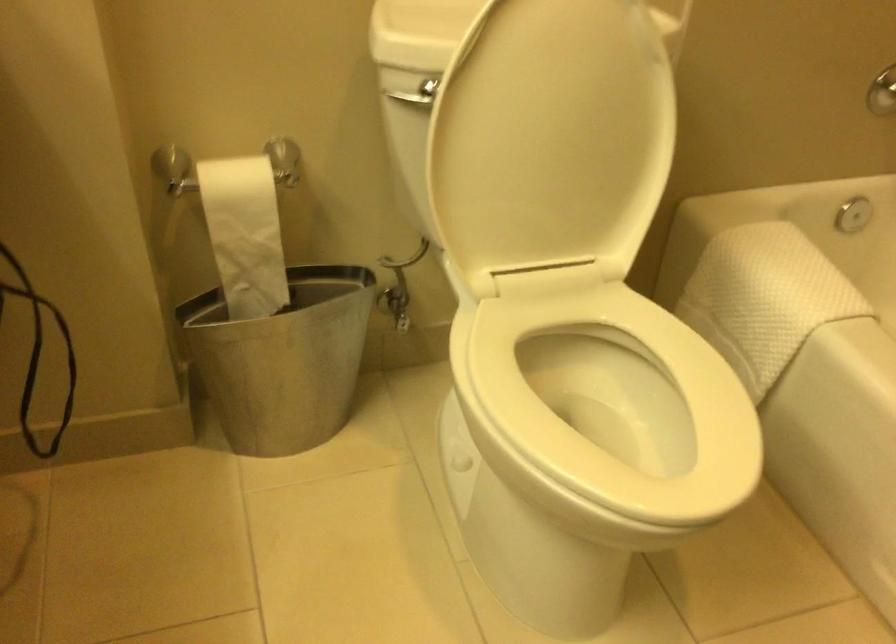
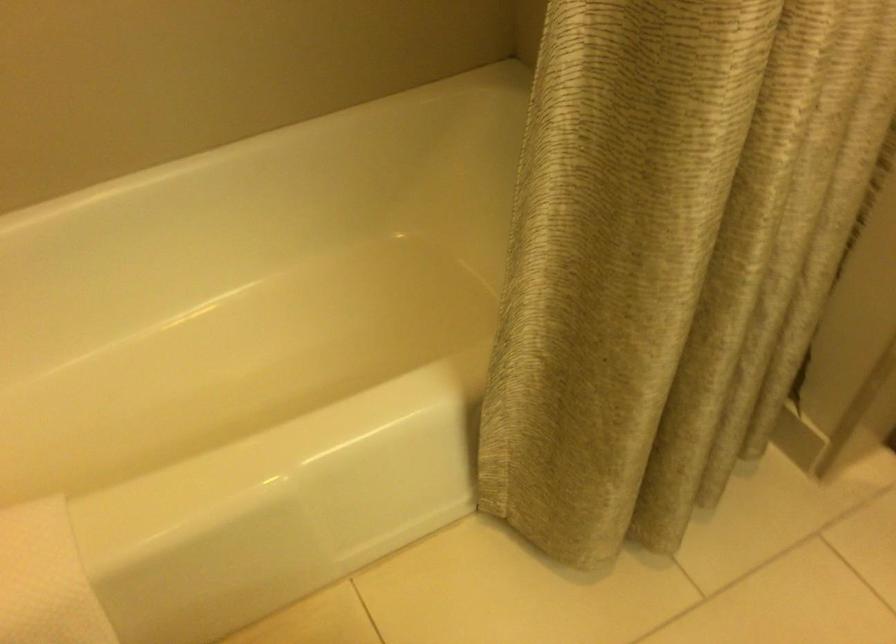
Based on the continuous images, in which direction is the camera rotating?

The camera rotated toward right-down.